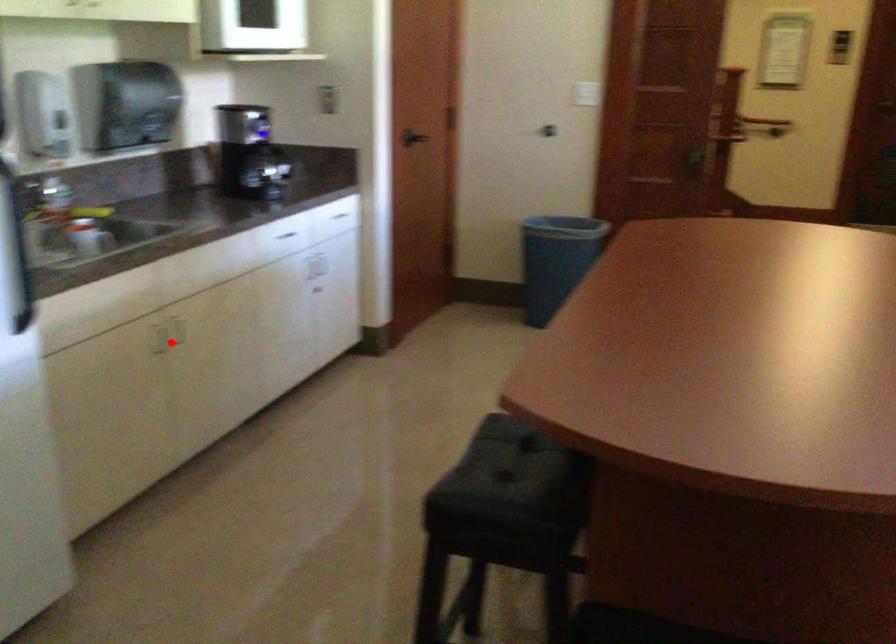
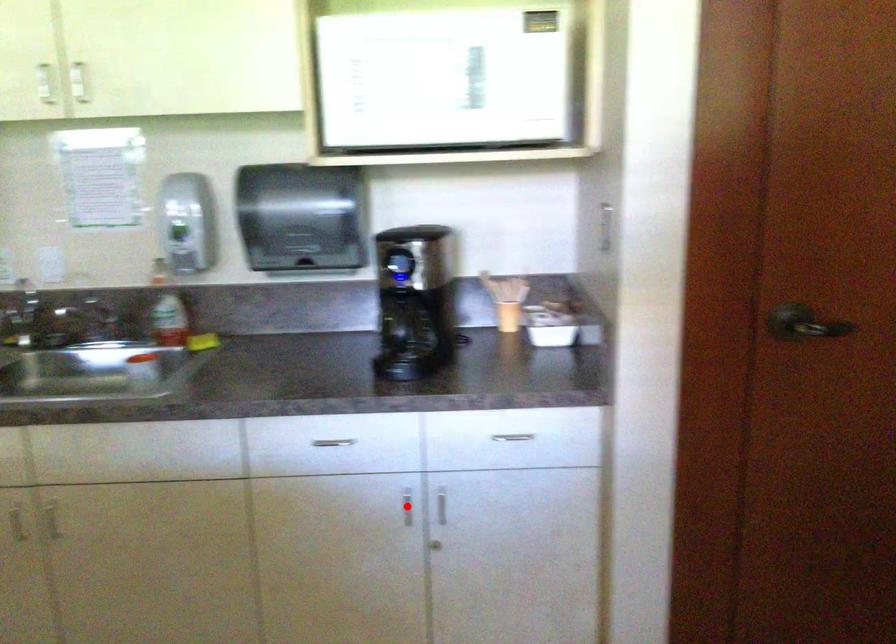
I am providing you with two images of the same scene from different viewpoints. A red point is marked on the first image and another point is marked on the second image. Do the highlighted points in image1 and image2 indicate the same real-world spot?

No